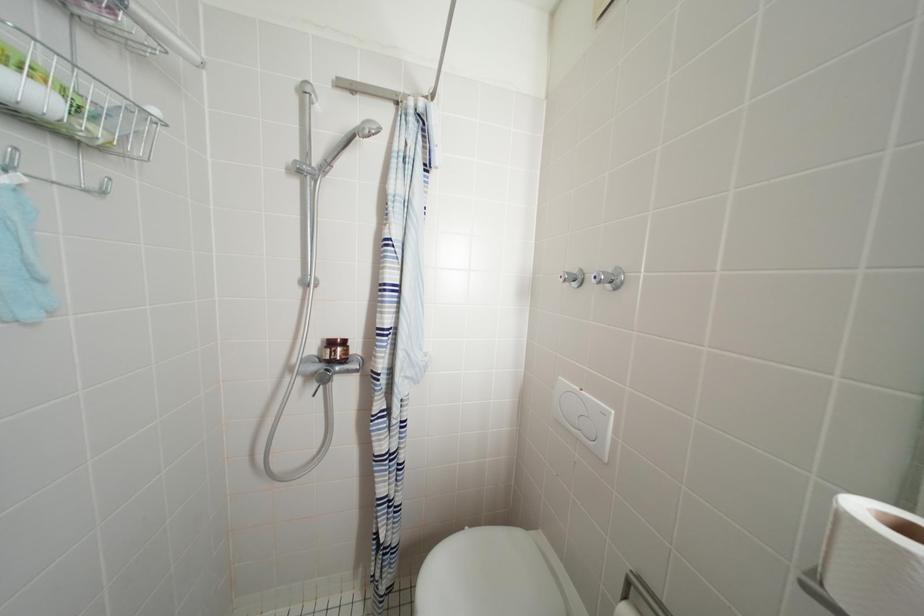
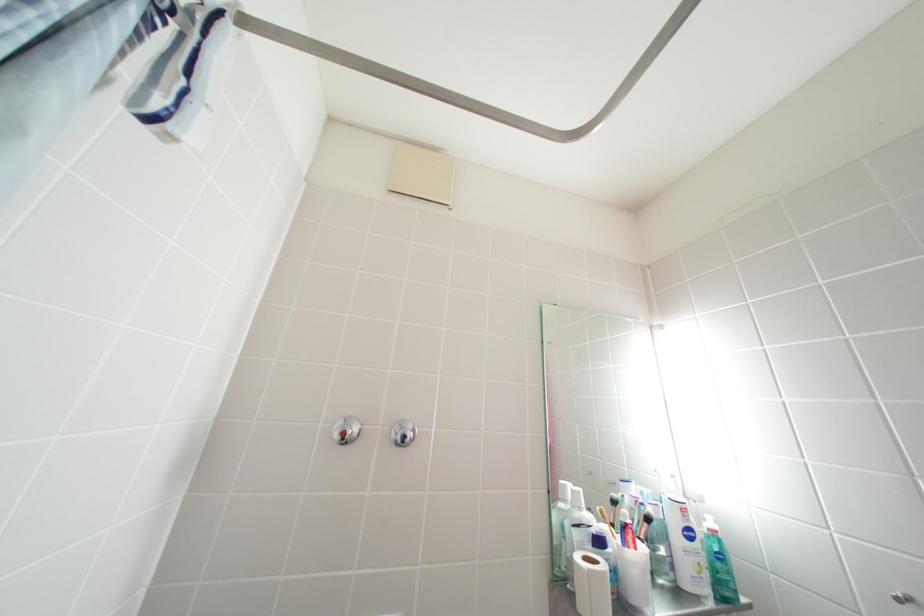
The images are taken continuously from a first-person perspective. In which direction is your viewpoint rotating?

The camera's rotation is toward right-up.